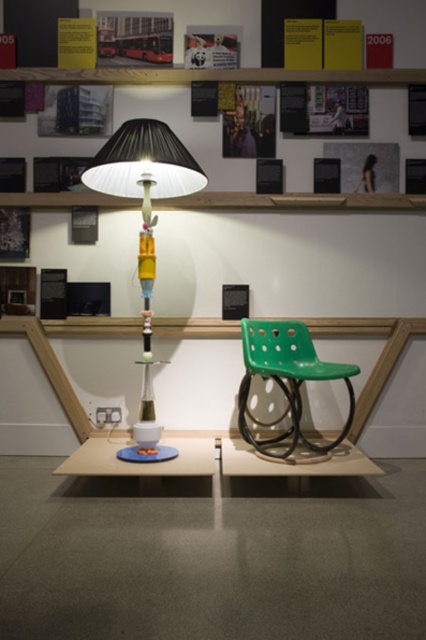
Which is in front, point (115, 180) or point (190, 458)?

Positioned in front is point (190, 458).

Is point (103, 179) in front of point (98, 472)?

No, it is not.

In order to click on matte black lampshade at center in this screenshot , I will do `click(144, 234)`.

Can you confirm if matte black lampshade at upper center is positioned to the right of matte white table at center?

Correct, you'll find matte black lampshade at upper center to the right of matte white table at center.

Is point (77, 70) positioned after point (167, 440)?

Yes, it is.

Find the location of a particular element. matte black lampshade at upper center is located at coordinates (239, 83).

Does point (178, 140) come in front of point (302, 442)?

Yes, it is.

Does matte black lampshade at center appear over green plastic chair at center?

Correct, matte black lampshade at center is located above green plastic chair at center.

Is point (138, 170) positioned behind point (259, 332)?

No, (138, 170) is in front of (259, 332).

Where is `matte black lampshade at center`? matte black lampshade at center is located at coordinates (144, 234).